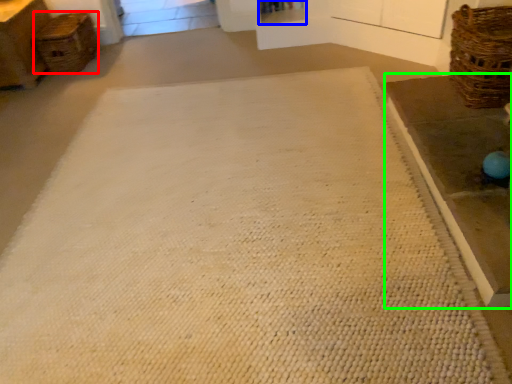
Question: Estimate the real-world distances between objects in this image. Which object is farther from basket (highlighted by a red box), shelf (highlighted by a blue box) or table (highlighted by a green box)?

Choices:
 (A) shelf
 (B) table

Answer: (B)